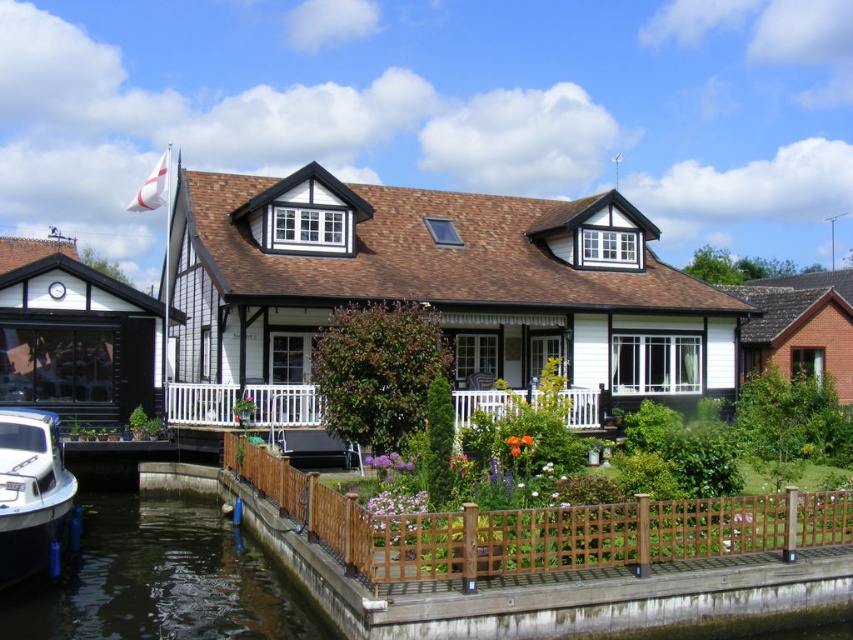
Which is more to the left, dark brown water at lower left or white wooden porch at center?

Positioned to the left is dark brown water at lower left.

Find the location of a particular element. dark brown water at lower left is located at coordinates (160, 580).

The image size is (853, 640). In order to click on dark brown water at lower left in this screenshot , I will do `click(160, 580)`.

Does dark brown water at lower left appear on the right side of white glossy boat at lower left?

Yes, dark brown water at lower left is to the right of white glossy boat at lower left.

Is dark brown water at lower left positioned at the back of white glossy boat at lower left?

No, dark brown water at lower left is in front of white glossy boat at lower left.

Where is `dark brown water at lower left`? dark brown water at lower left is located at coordinates (160, 580).

Locate an element on the screen. The width and height of the screenshot is (853, 640). dark brown water at lower left is located at coordinates (160, 580).

Does point (61, 540) come behind point (274, 420)?

No, it is not.

In the scene shown: Can you confirm if white glossy boat at lower left is thinner than white wooden porch at center?

Yes.

Identify the location of white glossy boat at lower left. (33, 497).